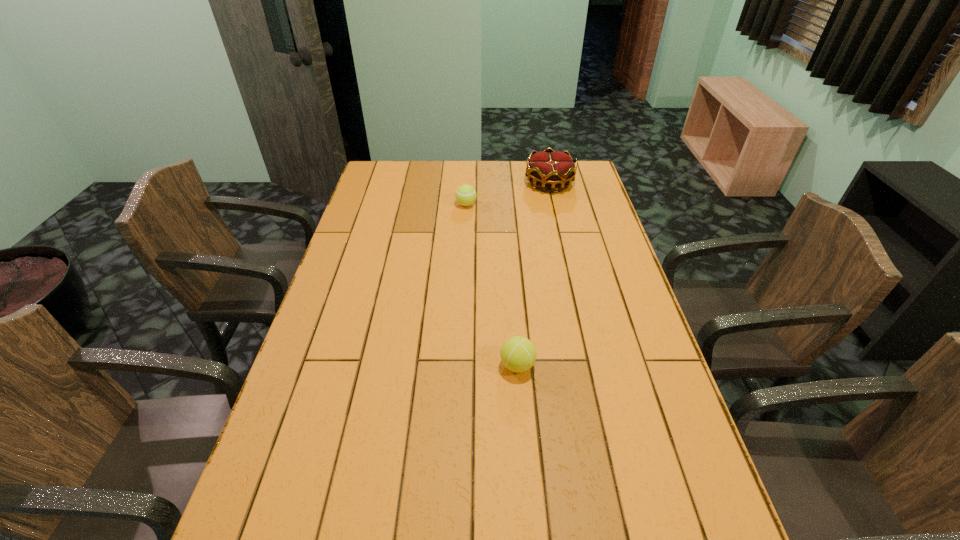
Where is `crown`? The image size is (960, 540). crown is located at coordinates (550, 168).

You are a GUI agent. You are given a task and a screenshot of the screen. Output one action in this format:
    pyautogui.click(x=<x>, y=<y>)
    Task: Click on the farthest object
    
    Given the screenshot: What is the action you would take?
    pyautogui.click(x=550, y=168)

You are a GUI agent. You are given a task and a screenshot of the screen. Output one action in this format:
    pyautogui.click(x=<x>, y=<y>)
    Task: Click on the nearer tennis ball
    
    Given the screenshot: What is the action you would take?
    pyautogui.click(x=518, y=354)

Identify the location of the second object from left to right. (518, 354).

Find the location of a particular element. the second nearest object is located at coordinates (465, 195).

Locate an element on the screen. This screenshot has height=540, width=960. the left tennis ball is located at coordinates (465, 195).

Where is `free location located on the left of the tallest object`? The image size is (960, 540). free location located on the left of the tallest object is located at coordinates (473, 183).

Find the location of a particular element. Image resolution: width=960 pixels, height=540 pixels. vacant point located on the left of the second object from left to right is located at coordinates (406, 366).

At what (x,y) coordinates should I click in order to perform the action: click on blank space located 0.390m on the right of the leftmost object. Please return your answer as a coordinate pair (x, y). This screenshot has width=960, height=540. Looking at the image, I should click on (579, 205).

Locate an element on the screen. The width and height of the screenshot is (960, 540). object at the far edge is located at coordinates (550, 168).